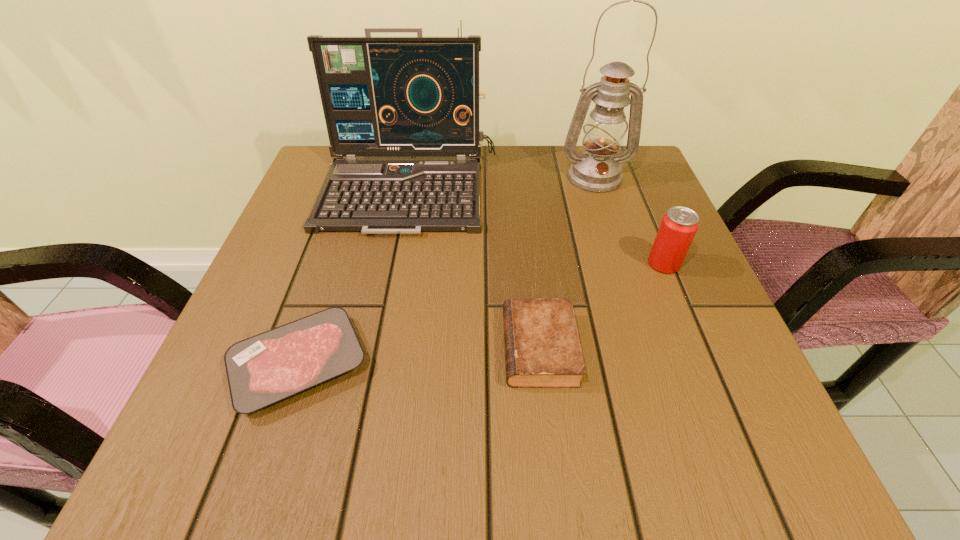
The width and height of the screenshot is (960, 540). Find the location of `empty location between the third tallest object and the fourth tallest object`. empty location between the third tallest object and the fourth tallest object is located at coordinates (602, 306).

Image resolution: width=960 pixels, height=540 pixels. In order to click on unoccupied position between the fourth shortest object and the third tallest object in this screenshot , I will do `click(537, 227)`.

I want to click on free spot between the fourth tallest object and the laptop computer, so click(x=474, y=269).

You are a GUI agent. You are given a task and a screenshot of the screen. Output one action in this format:
    pyautogui.click(x=<x>, y=<y>)
    Task: Click on the empty space that is in between the second shortest object and the third tallest object
    This screenshot has height=540, width=960.
    Given the screenshot: What is the action you would take?
    pyautogui.click(x=602, y=306)

This screenshot has height=540, width=960. In order to click on vacant area that lies between the oil lamp and the diary in this screenshot , I will do `click(567, 262)`.

Identify the location of free spot between the third nearest object and the second shortest object. (602, 306).

You are a GUI agent. You are given a task and a screenshot of the screen. Output one action in this format:
    pyautogui.click(x=<x>, y=<y>)
    Task: Click on the unoccupied position between the diary and the laptop computer
    The image size is (960, 540).
    Given the screenshot: What is the action you would take?
    pyautogui.click(x=474, y=269)

The height and width of the screenshot is (540, 960). What are the coordinates of `free spot between the can and the third object from left to right` in the screenshot? It's located at (602, 306).

Where is `vacant point located between the third shortest object and the shortest object`? The width and height of the screenshot is (960, 540). vacant point located between the third shortest object and the shortest object is located at coordinates (481, 314).

The height and width of the screenshot is (540, 960). In order to click on object that can be found as the third closest to the tallest object in this screenshot , I will do `click(542, 348)`.